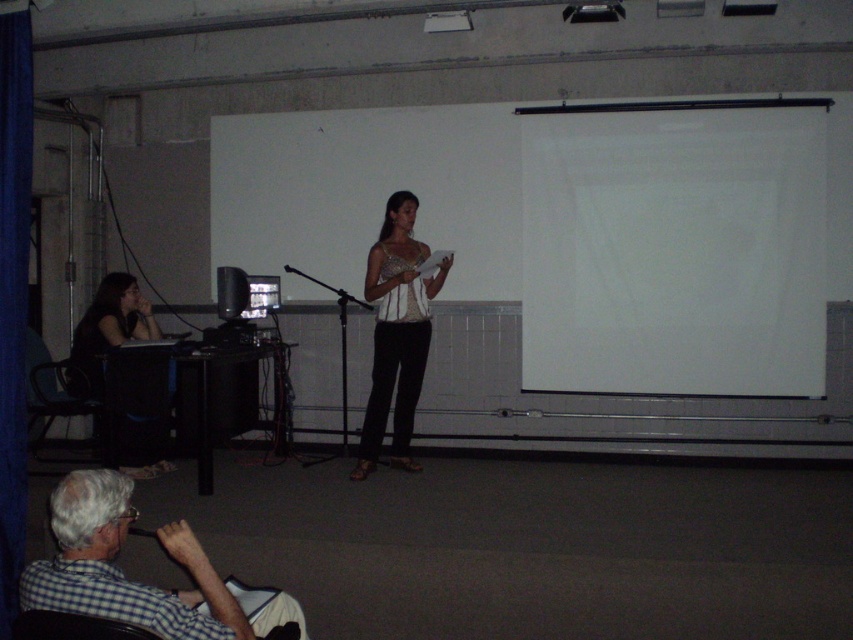
Question: Which of these objects is positioned farthest from the black plastic chair at left?

Choices:
 (A) white matte projection screen at upper right
 (B) dark hair at left

Answer: (A)

Question: Does white matte projection screen at upper right appear on the right side of black plastic projector at upper center?

Choices:
 (A) no
 (B) yes

Answer: (B)

Question: Which point is closer to the camera?

Choices:
 (A) black plastic projector at upper center
 (B) checkered fabric shirt at lower left
 (C) matte black monitor at left
 (D) dark hair at left

Answer: (B)

Question: Estimate the real-world distances between objects in this image. Which object is closer to the black plastic microphone at lower left?

Choices:
 (A) white matte projection screen at upper right
 (B) dark hair at left
 (C) matte black monitor at left
 (D) checkered fabric chair at lower left

Answer: (B)

Question: Observing the image, what is the correct spatial positioning of white matte projection screen at upper right in reference to black plastic chair at left?

Choices:
 (A) left
 (B) right

Answer: (B)

Question: Is black plastic chair at left further to the viewer compared to black plastic microphone at lower left?

Choices:
 (A) yes
 (B) no

Answer: (A)